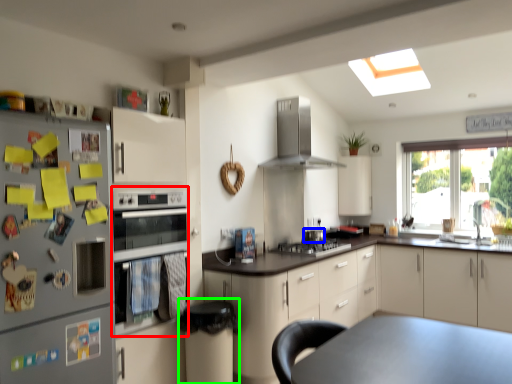
Question: Which is farther away from oven (highlighted by a red box)? appliance (highlighted by a blue box) or bar stool (highlighted by a green box)?

Choices:
 (A) appliance
 (B) bar stool

Answer: (A)